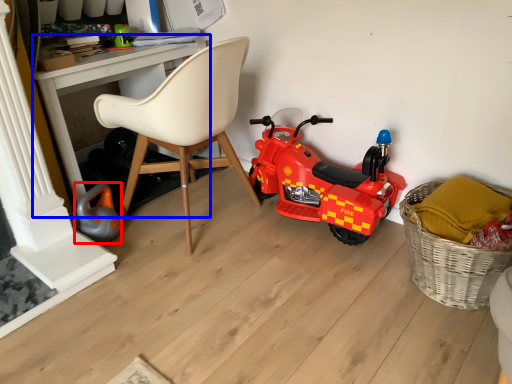
Question: Which object is closer to the camera taking this photo, toy (highlighted by a red box) or desk (highlighted by a blue box)?

Choices:
 (A) toy
 (B) desk

Answer: (B)